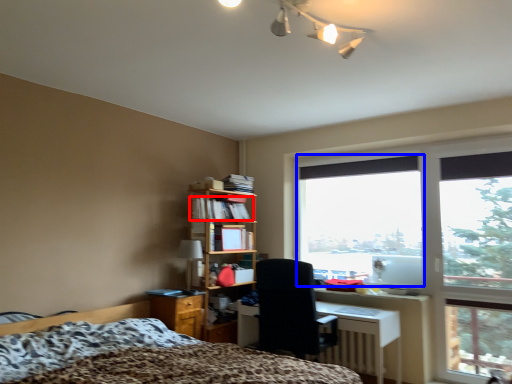
Question: Among these objects, which one is farthest to the camera, book (highlighted by a red box) or window screen (highlighted by a blue box)?

Choices:
 (A) book
 (B) window screen

Answer: (A)